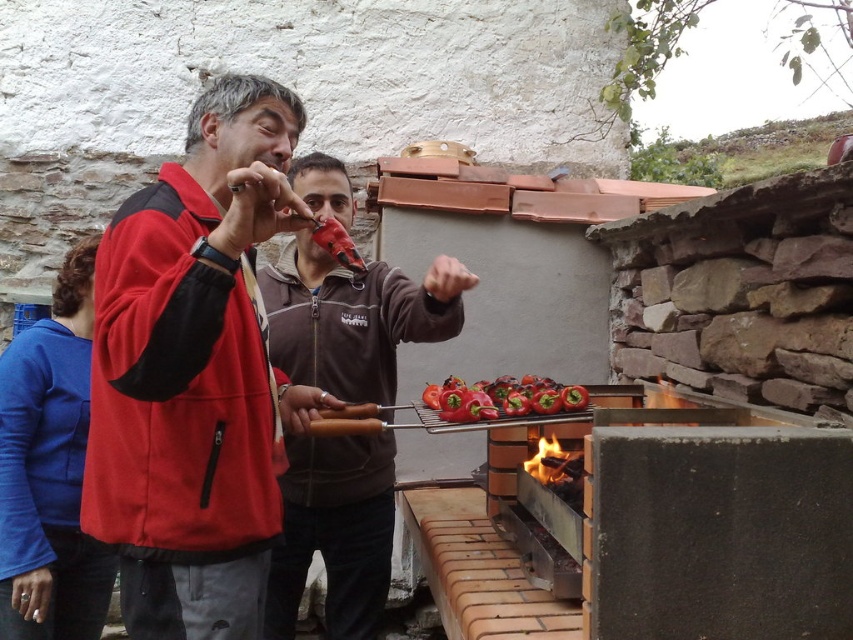
Question: Which of the following is the closest to the observer?

Choices:
 (A) red glossy bell peppers at center
 (B) brown zip-up jacket at center
 (C) red fleece jacket at center
 (D) charcoal black wood at center

Answer: (C)

Question: Among these objects, which one is nearest to the camera?

Choices:
 (A) red glossy bell peppers at center
 (B) brown zip-up jacket at center

Answer: (B)

Question: Is red fleece jacket at center smaller than brown zip-up jacket at center?

Choices:
 (A) no
 (B) yes

Answer: (B)

Question: Does red fleece jacket at center have a greater width compared to red glossy bell peppers at center?

Choices:
 (A) no
 (B) yes

Answer: (B)

Question: Does brown zip-up jacket at center come behind charcoal black wood at center?

Choices:
 (A) yes
 (B) no

Answer: (B)

Question: Which object is closer to the camera taking this photo?

Choices:
 (A) brown zip-up jacket at center
 (B) charcoal black wood at center
 (C) red fleece jacket at center
 (D) red glossy bell peppers at center

Answer: (C)